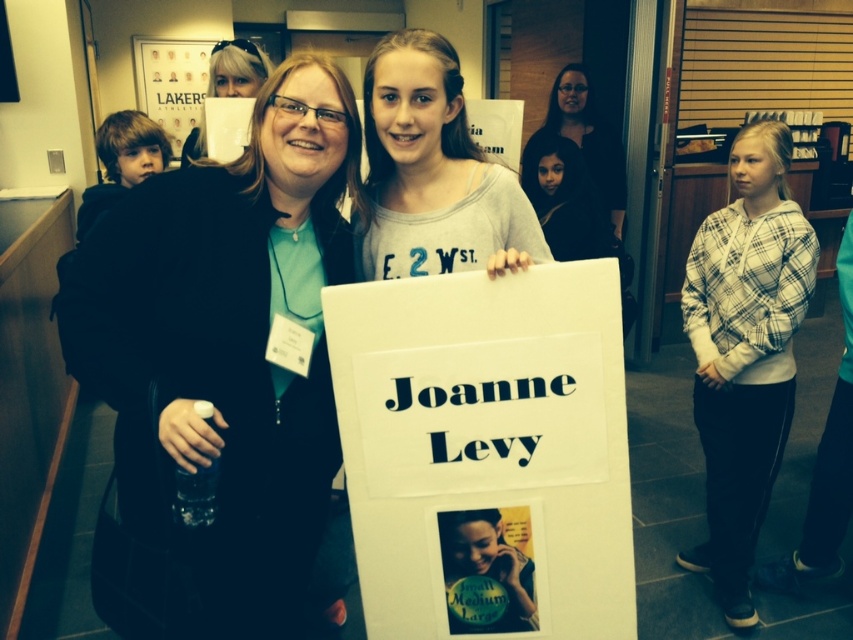
Does matte black shirt at upper center have a lesser height compared to white paper poster at upper left?

Yes, matte black shirt at upper center is shorter than white paper poster at upper left.

Locate an element on the screen. The image size is (853, 640). matte black shirt at upper center is located at coordinates (582, 141).

What are the coordinates of `matte black shirt at upper center` in the screenshot? It's located at (582, 141).

This screenshot has width=853, height=640. Describe the element at coordinates (486, 449) in the screenshot. I see `white paper sign at center` at that location.

Does point (506, 412) come in front of point (200, 54)?

That is True.

This screenshot has height=640, width=853. Describe the element at coordinates (486, 449) in the screenshot. I see `white paper sign at center` at that location.

Identify the location of white paper sign at center. The height and width of the screenshot is (640, 853). (486, 449).

Is gray cotton shirt at center above white paper poster at upper left?

Actually, gray cotton shirt at center is below white paper poster at upper left.

What are the coordinates of `gray cotton shirt at center` in the screenshot? It's located at (433, 172).